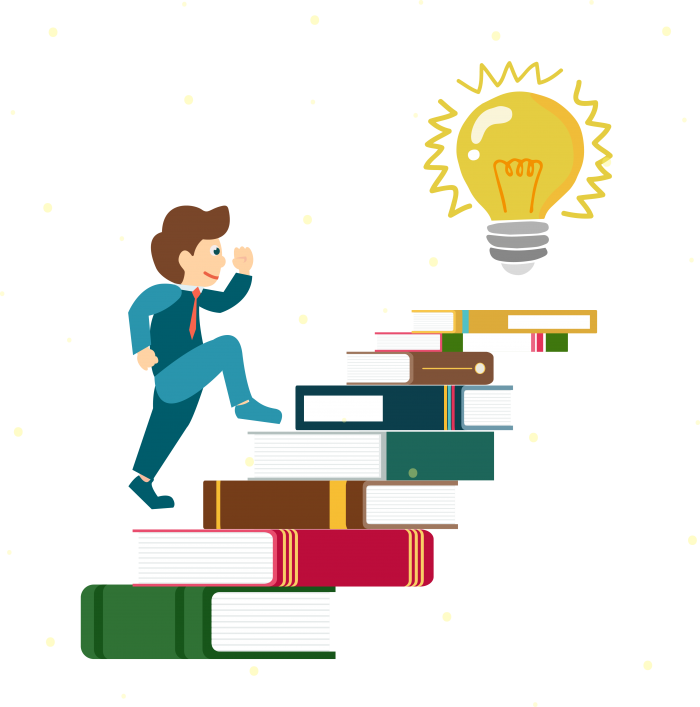
You are a GUI agent. You are given a task and a screenshot of the screen. Output one action in this format:
    pyautogui.click(x=<x>, y=<y>)
    Task: Click on the spirals on light bulb
    
    Given the screenshot: What is the action you would take?
    pyautogui.click(x=519, y=271), pyautogui.click(x=521, y=255), pyautogui.click(x=519, y=240), pyautogui.click(x=519, y=227)